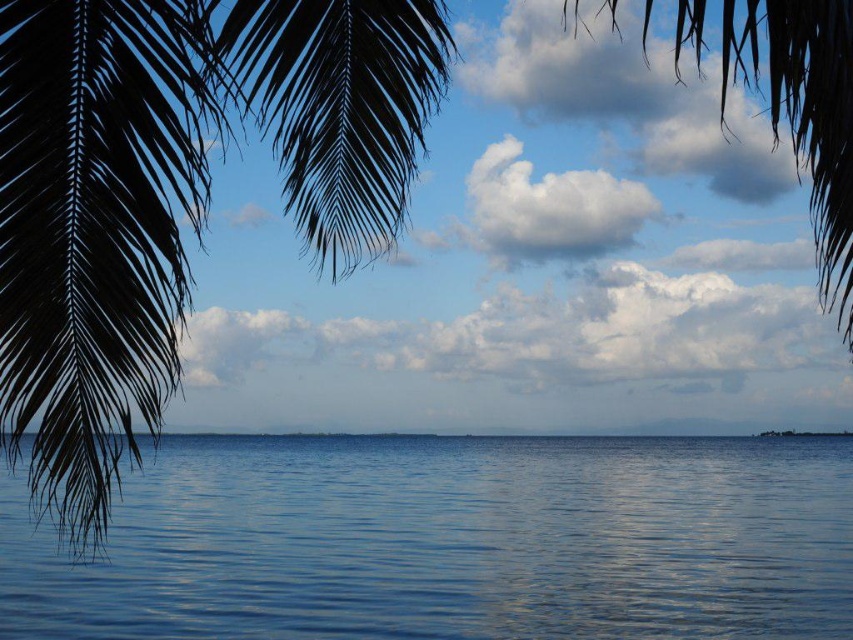
You are standing at the edge of the water in the coastal scene. If you look towards the point labeled as point (451, 541), what will you see there?

The point (451, 541) corresponds to glossy blue water at center, so you will see glossy blue water at center there.

You are a photographer trying to capture the glossy blue water at center and the silky brown leaf at upper center in a single shot. Which object will appear closer to the camera in the final photo?

The glossy blue water at center will appear closer to the camera because the silky brown leaf at upper center is positioned behind it, making the water more prominent in the foreground.